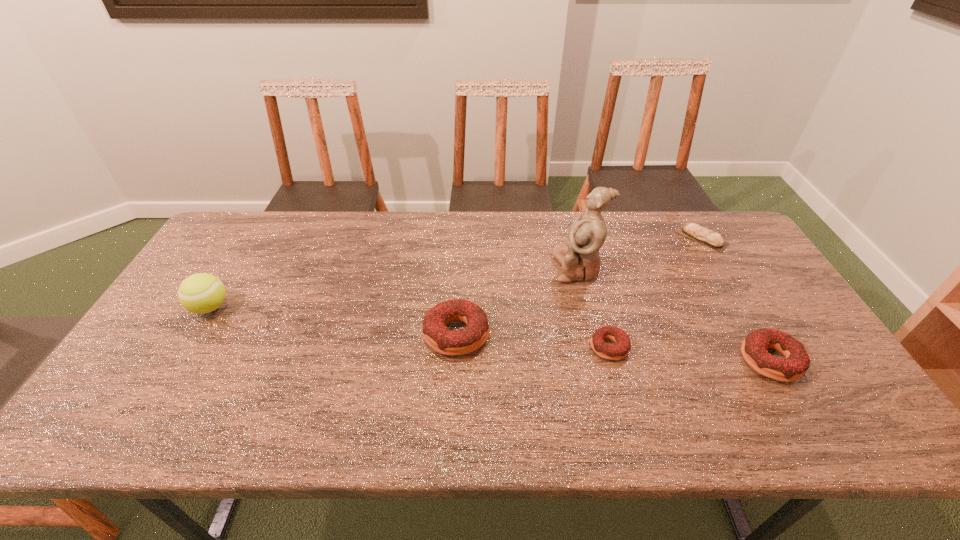
At what (x,y) coordinates should I click in order to perform the action: click on doughnut located in the right edge section of the desktop. Please return your answer as a coordinate pair (x, y). This screenshot has width=960, height=540. Looking at the image, I should click on (795, 364).

This screenshot has width=960, height=540. I want to click on pita bread that is at the right edge, so click(x=703, y=235).

I want to click on object situated at the far right corner, so click(x=703, y=235).

Locate an element on the screen. object present at the near right corner is located at coordinates (795, 364).

Image resolution: width=960 pixels, height=540 pixels. Find the location of `vacant space at the far edge of the desktop`. vacant space at the far edge of the desktop is located at coordinates (569, 212).

In the image, there is a desktop. At what (x,y) coordinates should I click in order to perform the action: click on free space at the near edge. Please return your answer as a coordinate pair (x, y). Looking at the image, I should click on (612, 400).

Locate an element on the screen. vacant space at the left edge of the desktop is located at coordinates (200, 337).

In the image, there is a desktop. Where is `vacant space at the right edge`? The width and height of the screenshot is (960, 540). vacant space at the right edge is located at coordinates pyautogui.click(x=832, y=369).

I want to click on free region at the far left corner of the desktop, so click(248, 237).

The width and height of the screenshot is (960, 540). What are the coordinates of `vacant region at the near left corner of the desktop` in the screenshot? It's located at (158, 400).